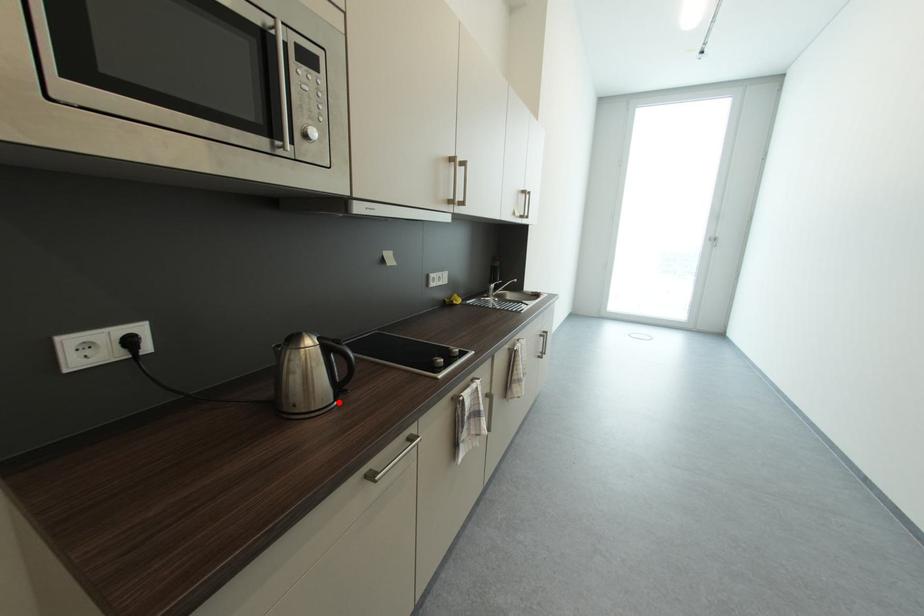
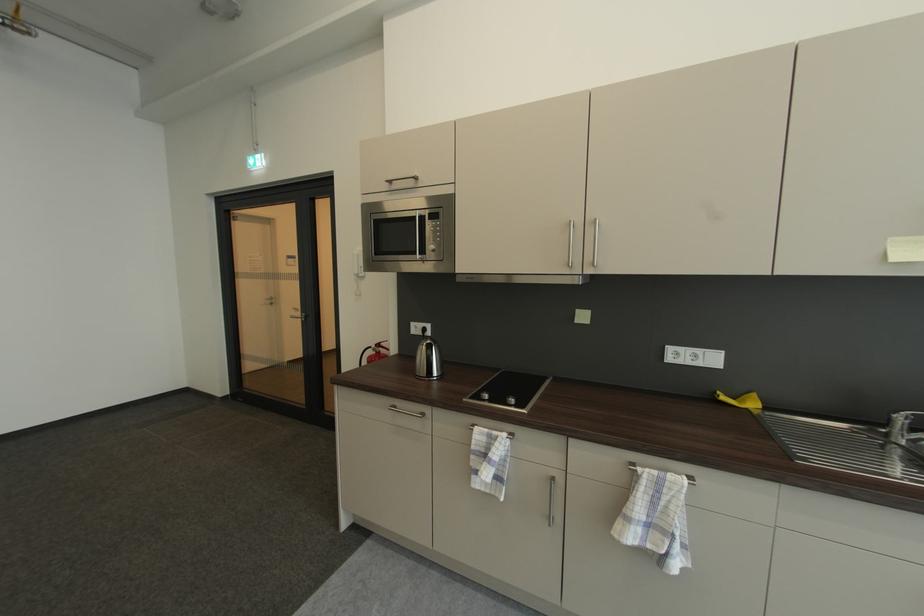
The point at the highlighted location is marked in the first image. Where is the corresponding point in the second image?

(432, 378)